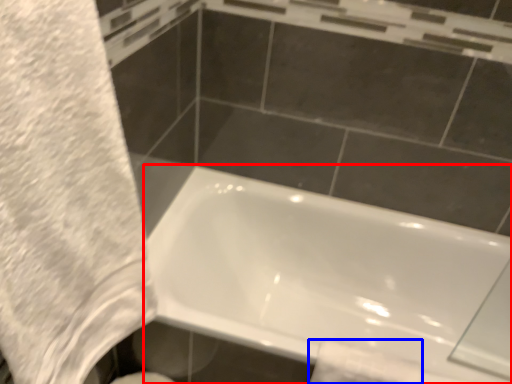
Question: Which of the following is the closest to the observer, bathtub (highlighted by a red box) or toilet paper (highlighted by a blue box)?

Choices:
 (A) bathtub
 (B) toilet paper

Answer: (A)